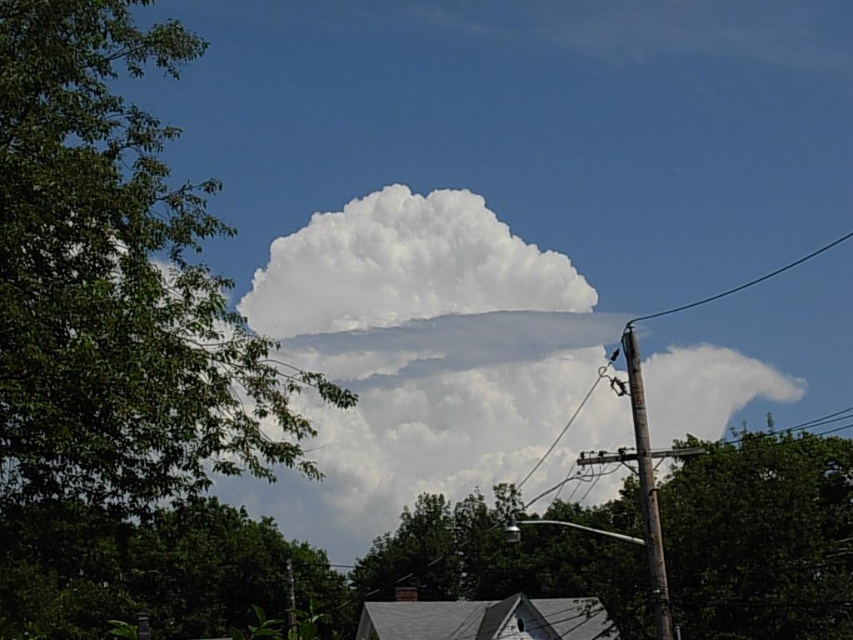
Can you confirm if white fluffy cloud at upper center is taller than black wire at upper right?

Indeed, white fluffy cloud at upper center has a greater height compared to black wire at upper right.

Identify the location of white fluffy cloud at upper center. (404, 266).

Is the position of white fluffy cloud at upper center more distant than that of wooden telephone pole at right?

Yes, white fluffy cloud at upper center is further from the viewer.

Is the position of white fluffy cloud at upper center less distant than that of wooden telephone pole at right?

No.

What are the coordinates of `white fluffy cloud at upper center` in the screenshot? It's located at (404, 266).

Which of these two, green leafy tree at center or white fluffy cloud at upper center, stands taller?

green leafy tree at center is taller.

Which is above, green leafy tree at center or white fluffy cloud at upper center?

Positioned higher is white fluffy cloud at upper center.

Measure the distance between green leafy tree at center and camera.

green leafy tree at center is 85.60 feet away from camera.

Identify the location of green leafy tree at center. The height and width of the screenshot is (640, 853). (761, 538).